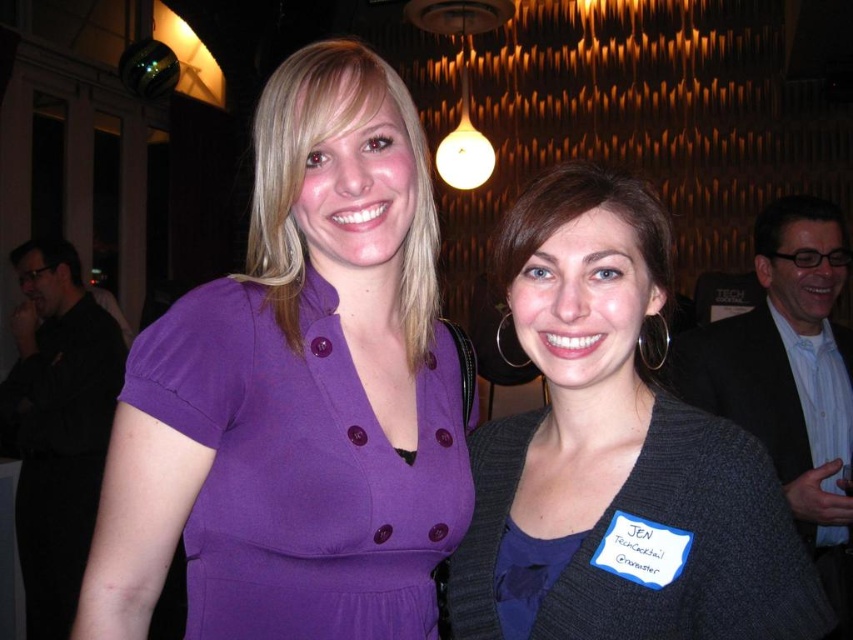
Between gray textured cardigan at center and matte glass globe at upper center, which one has less height?

gray textured cardigan at center

Between gray textured cardigan at center and matte glass globe at upper center, which one is positioned lower?

gray textured cardigan at center is lower down.

Find the location of a particular element. The width and height of the screenshot is (853, 640). gray textured cardigan at center is located at coordinates (616, 456).

Can you confirm if matte purple dress at center is bigger than gray textured cardigan at center?

Indeed, matte purple dress at center has a larger size compared to gray textured cardigan at center.

Does matte purple dress at center have a lesser width compared to gray textured cardigan at center?

No.

Is point (419, 426) closer to camera compared to point (634, 568)?

No, (419, 426) is further to viewer.

This screenshot has width=853, height=640. Find the location of `matte purple dress at center`. matte purple dress at center is located at coordinates (297, 394).

Does matte purple dress at center appear over matte glass globe at upper center?

Incorrect, matte purple dress at center is not positioned above matte glass globe at upper center.

Which is behind, point (126, 593) or point (467, 104)?

The point (467, 104) is behind.

What do you see at coordinates (297, 394) in the screenshot? This screenshot has height=640, width=853. I see `matte purple dress at center` at bounding box center [297, 394].

You are a GUI agent. You are given a task and a screenshot of the screen. Output one action in this format:
    pyautogui.click(x=<x>, y=<y>)
    Task: Click on the matte purple dress at center
    The height and width of the screenshot is (640, 853).
    Given the screenshot: What is the action you would take?
    pyautogui.click(x=297, y=394)